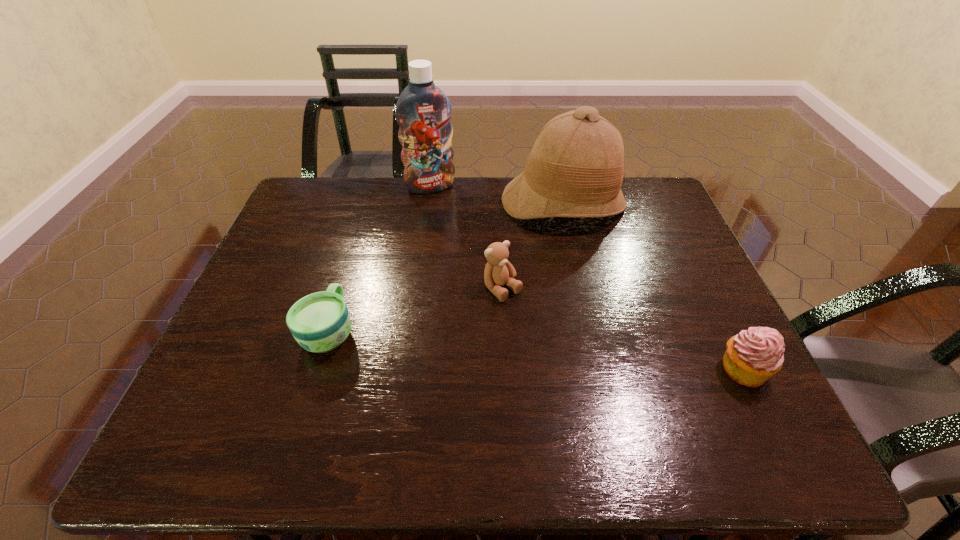
Find the location of a particular element. The width and height of the screenshot is (960, 540). the leftmost object is located at coordinates (320, 322).

At what (x,y) coordinates should I click in order to perform the action: click on cup. Please return your answer as a coordinate pair (x, y). Looking at the image, I should click on (320, 322).

This screenshot has height=540, width=960. Identify the location of cupcake. (754, 355).

Where is `teddy bear`? The width and height of the screenshot is (960, 540). teddy bear is located at coordinates (498, 271).

The image size is (960, 540). I want to click on the second tallest object, so tap(575, 169).

Where is `the fourth object from right to left`? The height and width of the screenshot is (540, 960). the fourth object from right to left is located at coordinates (423, 111).

At what (x,y) coordinates should I click in order to perform the action: click on the tallest object. Please return your answer as a coordinate pair (x, y). The height and width of the screenshot is (540, 960). Looking at the image, I should click on (423, 111).

This screenshot has width=960, height=540. Identify the location of vacant space situated on the back of the leftmost object. point(353,251).

I want to click on free location located 0.080m on the left of the rightmost object, so click(x=683, y=369).

The height and width of the screenshot is (540, 960). I want to click on vacant space located on the front-facing side of the teddy bear, so click(x=612, y=399).